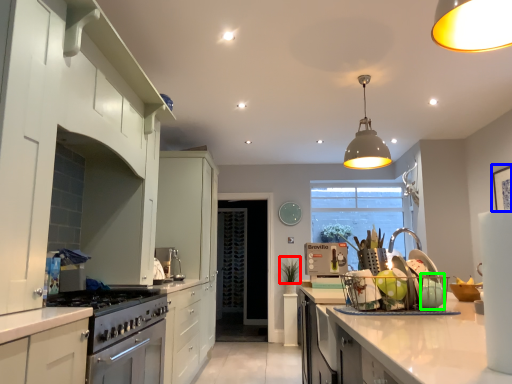
Question: Which object is the closest to the plant (highlighted by a red box)? Choose among these: picture frame (highlighted by a blue box) or appliance (highlighted by a green box).

Choices:
 (A) picture frame
 (B) appliance

Answer: (A)